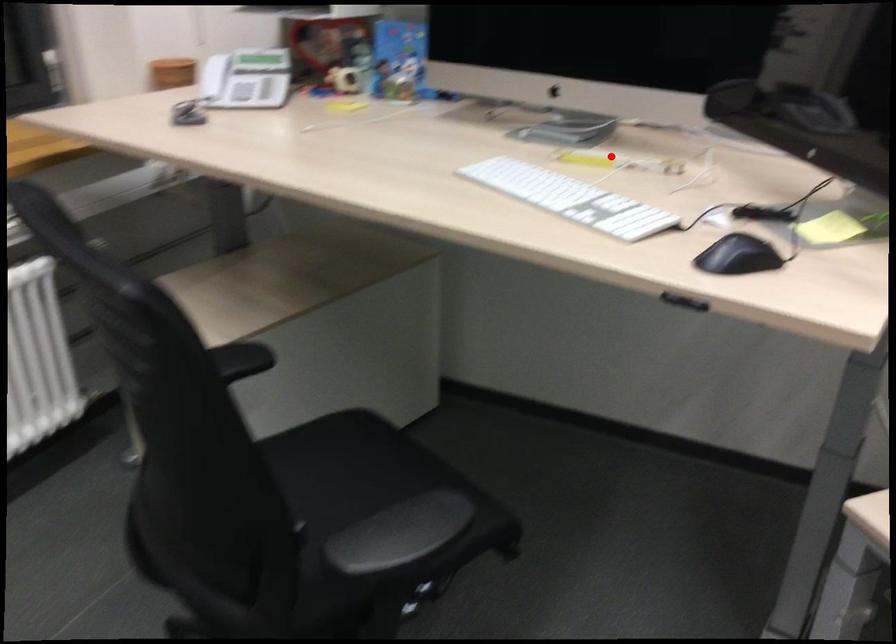
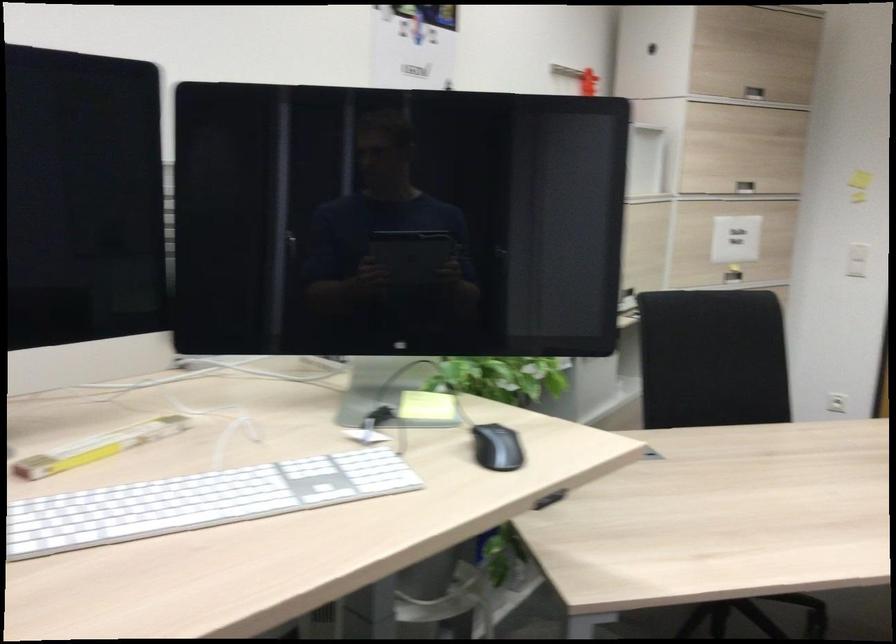
Question: I am providing you with two images of the same scene from different viewpoints. A red point is shown in image1. For the corresponding object point in image2, is it positioned nearer or farther from the camera?

Choices:
 (A) Nearer
 (B) Farther

Answer: (A)